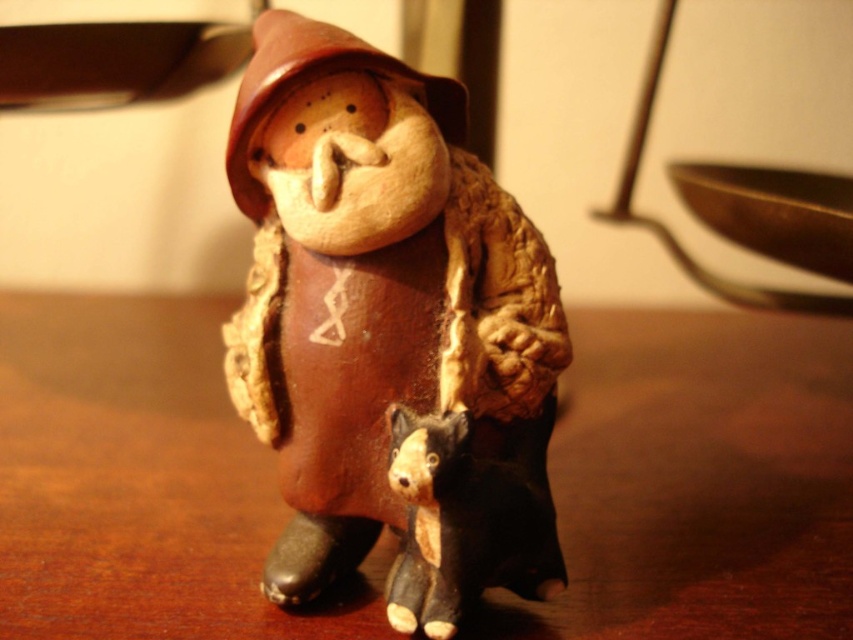
Where is `brown wooden table at center`? This screenshot has width=853, height=640. brown wooden table at center is located at coordinates (699, 483).

Identify the location of brown wooden table at center. (699, 483).

Does point (281, 106) come closer to viewer compared to point (418, 600)?

Yes, it is in front of point (418, 600).

Can you confirm if matte clay figure at center is thinner than matte black dog at lower center?

In fact, matte clay figure at center might be wider than matte black dog at lower center.

Where is `matte clay figure at center`? The width and height of the screenshot is (853, 640). matte clay figure at center is located at coordinates (390, 330).

The height and width of the screenshot is (640, 853). I want to click on matte clay figure at center, so click(x=390, y=330).

Which is below, brown wooden table at center or matte black dog at lower center?

matte black dog at lower center is below.

Locate an element on the screen. brown wooden table at center is located at coordinates (699, 483).